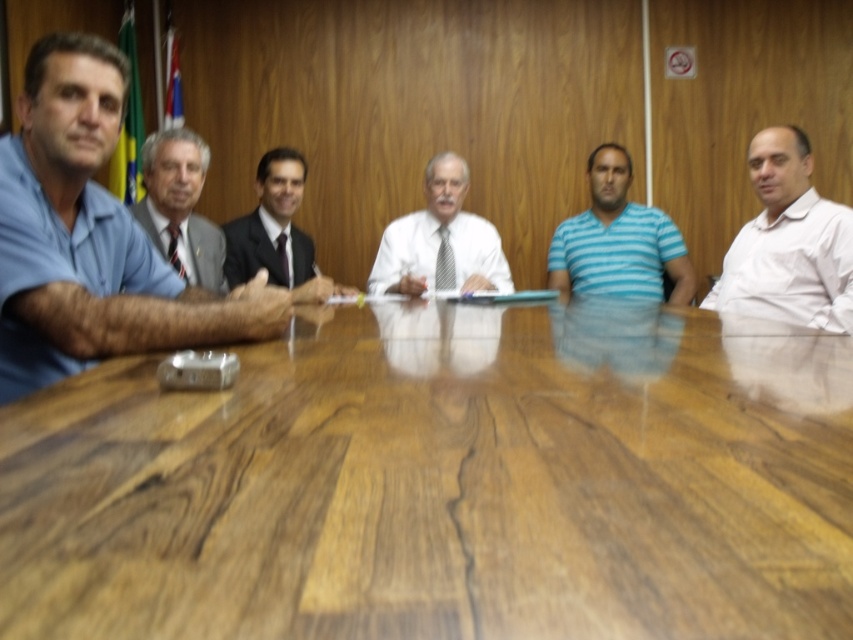
In the scene shown: You are organizing a team photo and need to arrange the white shirt at right and the blue striped shirt at center based on their sizes. Which should be placed first if you want to arrange them from largest to smallest?

The white shirt at right should be placed first since it has a larger size compared to the blue striped shirt at center.

You are organizing a meeting and need to ensure there is enough space between the wooden table at center and the gray suit at center for attendees to move comfortably. Based on their heights, is there sufficient vertical clearance?

The wooden table at center is shorter than the gray suit at center, meaning the table does not obstruct the vertical space needed for attendees to move comfortably between them.